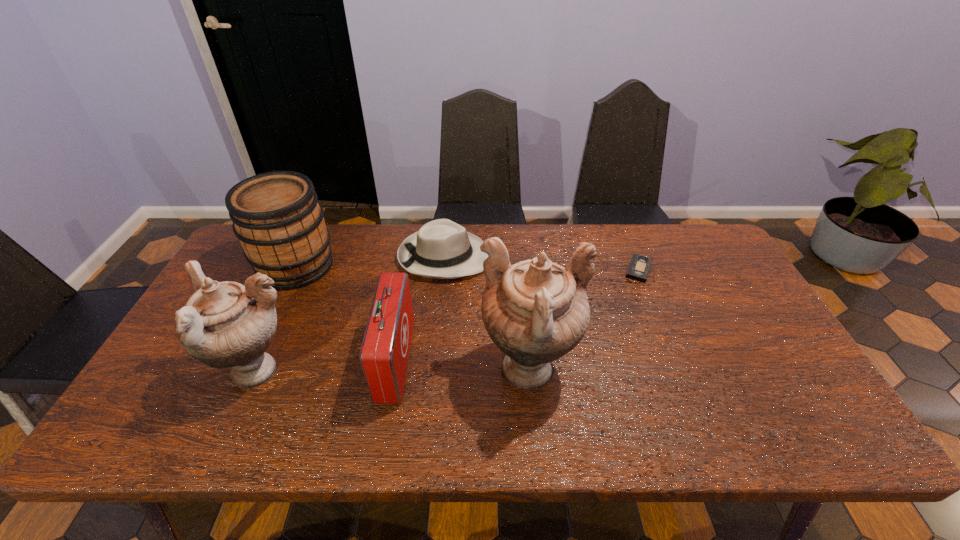
Locate an element on the screen. object present at the far left corner is located at coordinates [x=276, y=216].

The image size is (960, 540). I want to click on object that is positioned at the near left corner, so click(226, 324).

Identify the location of blank area at the far edge. The image size is (960, 540). (372, 228).

Identify the location of free space at the near edge of the desktop. (298, 389).

Identify the location of free spot at the right edge of the desktop. (696, 293).

The height and width of the screenshot is (540, 960). In the image, there is a desktop. What are the coordinates of `vacant space at the near left corner` in the screenshot? It's located at (150, 387).

Where is `vacant space at the far right corner of the desktop`? vacant space at the far right corner of the desktop is located at coordinates click(x=698, y=235).

Find the location of a particular element. Image resolution: width=960 pixels, height=540 pixels. free space at the near right corner is located at coordinates (795, 389).

Locate an element on the screen. The height and width of the screenshot is (540, 960). free spot between the fourth tallest object and the right urn is located at coordinates tap(463, 366).

At what (x,y) coordinates should I click in order to perform the action: click on object that can be found as the third closest to the shorter urn. Please return your answer as a coordinate pair (x, y). The width and height of the screenshot is (960, 540). Looking at the image, I should click on (442, 249).